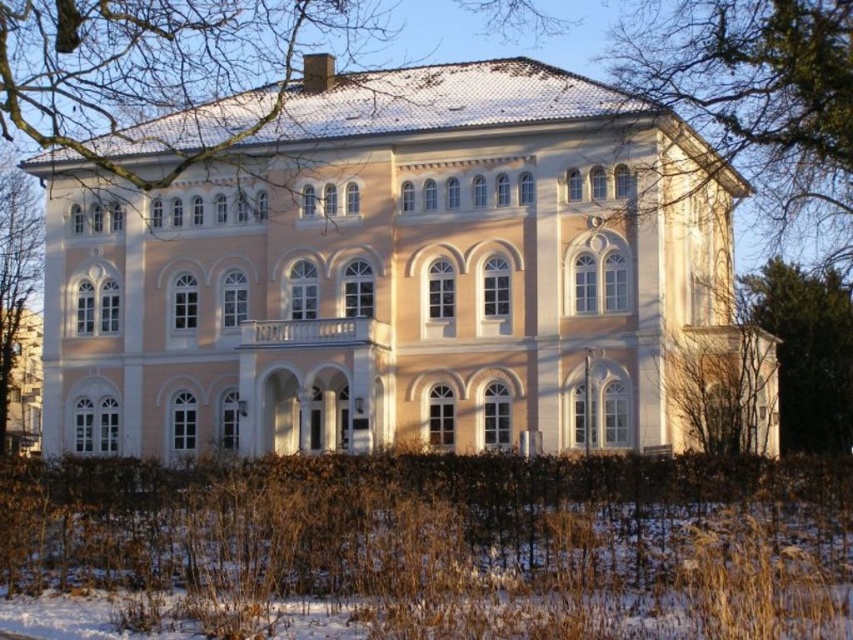
Question: Which object is closer to the camera taking this photo?

Choices:
 (A) bare branches at upper left
 (B) green leafy tree at left
 (C) green leafy tree at right
 (D) beige/smooth mansion at center

Answer: (A)

Question: Is beige/smooth mansion at center smaller than green leafy tree at upper right?

Choices:
 (A) no
 (B) yes

Answer: (A)

Question: Considering the real-world distances, which object is closest to the green leafy tree at upper right?

Choices:
 (A) beige/smooth mansion at center
 (B) bare branches at upper left
 (C) green leafy tree at right

Answer: (C)

Question: Which point appears farthest from the camera in this image?

Choices:
 (A) (25, 252)
 (B) (833, 451)

Answer: (A)

Question: Can you confirm if beige/smooth mansion at center is smaller than green leafy tree at left?

Choices:
 (A) no
 (B) yes

Answer: (A)

Question: Is beige/smooth mansion at center positioned before bare branches at upper left?

Choices:
 (A) yes
 (B) no

Answer: (B)